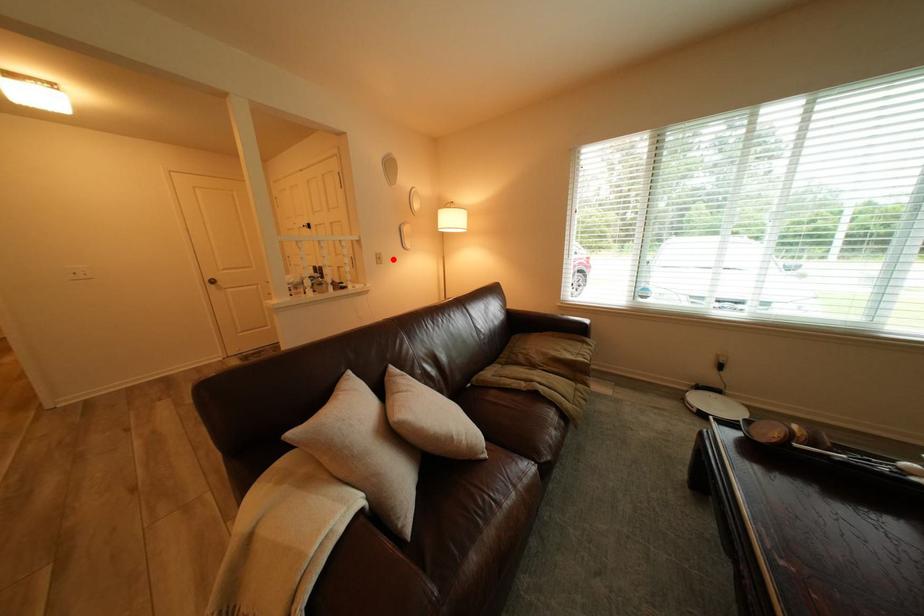
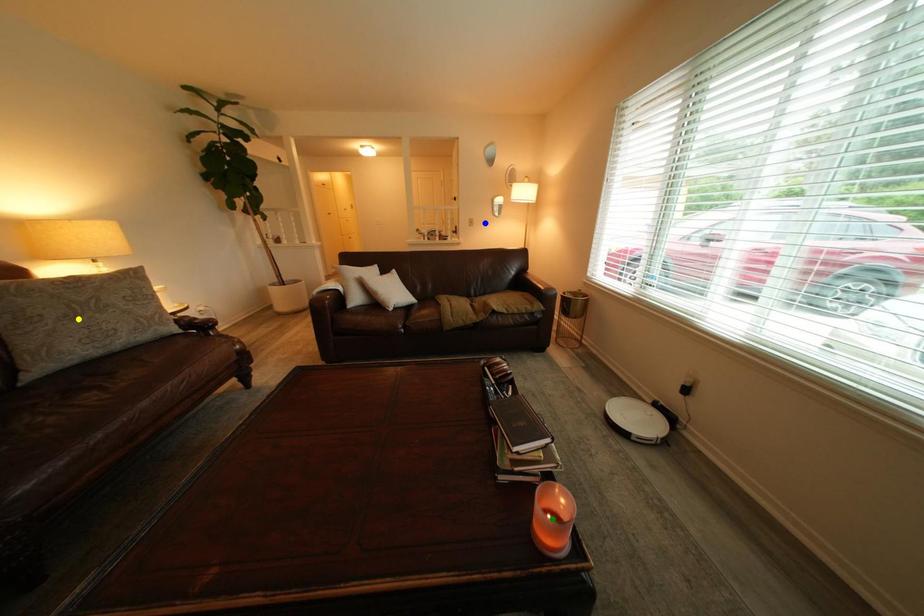
Question: I am providing you with two images of the same scene from different viewpoints. A red point is marked on the first image. You are given multiple points on the second image. Which point in image 2 is actually the same real-world point as the red point in image 1?

Choices:
 (A) yellow point
 (B) blue point
 (C) green point

Answer: (B)